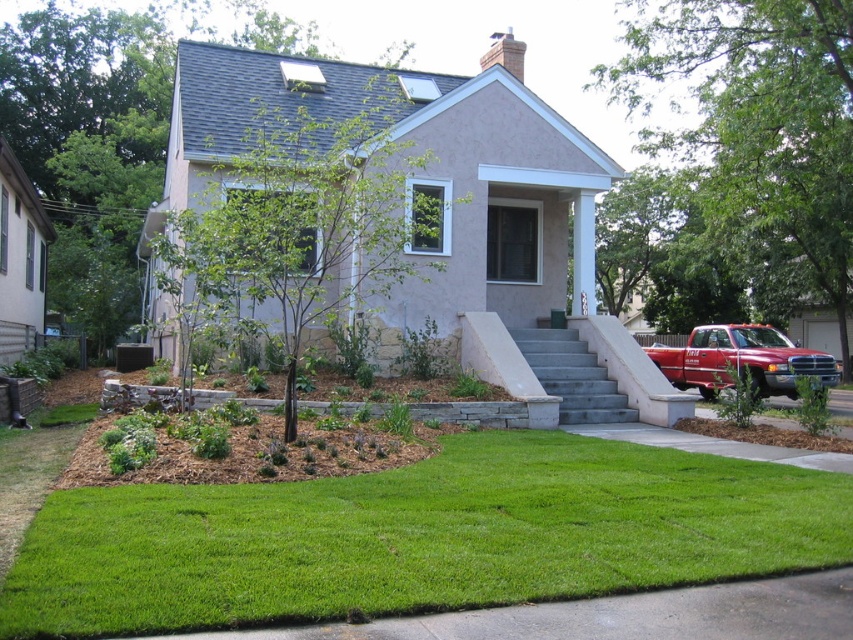
You are a gardener who needs to mow the green lawn at center. The matte red truck at right is blocking your path. Can you drive your lawnmower around the truck to access the lawn?

The green lawn at center has a lesser height compared to matte red truck at right, so the truck is taller than the lawn. Since the truck is blocking the path, you can drive your lawnmower around the truck to access the green lawn at center as the truck is taller but not wider than the lawn area.